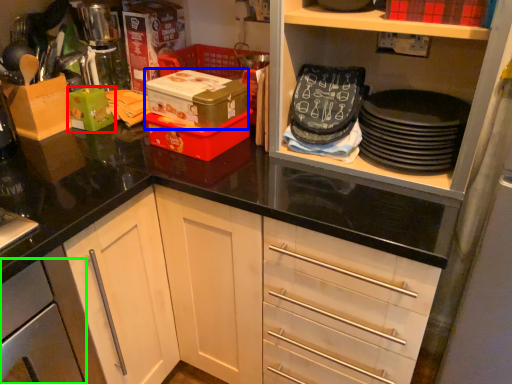
Question: Considering the real-world distances, which object is closest to box (highlighted by a red box)? box (highlighted by a blue box) or cabinetry (highlighted by a green box).

Choices:
 (A) box
 (B) cabinetry

Answer: (A)